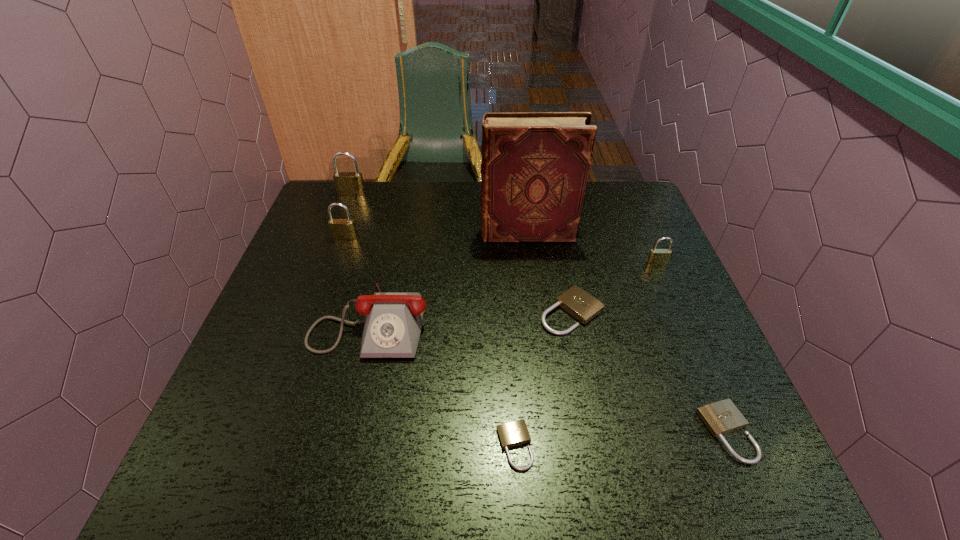
The width and height of the screenshot is (960, 540). I want to click on the second biggest beige padlock, so click(721, 417).

I want to click on the rightmost beige padlock, so click(721, 417).

Find the location of a particular element. the fourth padlock from right to left is located at coordinates (515, 433).

Locate an element on the screen. the leftmost beige padlock is located at coordinates (515, 433).

Locate an element on the screen. The image size is (960, 540). free location located on the spine side of the hardback book is located at coordinates (387, 233).

What are the coordinates of `free space located 0.110m on the spine side of the hardback book` in the screenshot? It's located at (442, 233).

You are a GUI agent. You are given a task and a screenshot of the screen. Output one action in this format:
    pyautogui.click(x=<x>, y=<y>)
    Task: Click on the free space located 0.330m on the spine side of the hardback book
    The width and height of the screenshot is (960, 540).
    Given the screenshot: What is the action you would take?
    pyautogui.click(x=366, y=233)

Identify the location of vacant space located 0.370m on the front-facing side of the biggest brass padlock. The width and height of the screenshot is (960, 540). (322, 276).

This screenshot has height=540, width=960. I want to click on free space located 0.060m on the front-facing side of the second farthest padlock, so click(x=340, y=254).

Identify the location of vacant space situated 0.060m on the dial of the red telephone. (356, 384).